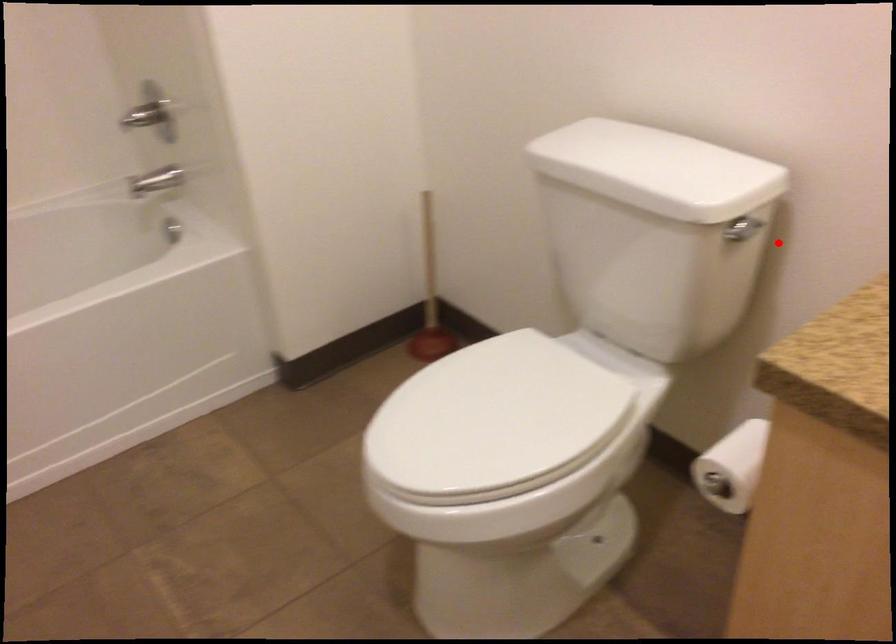
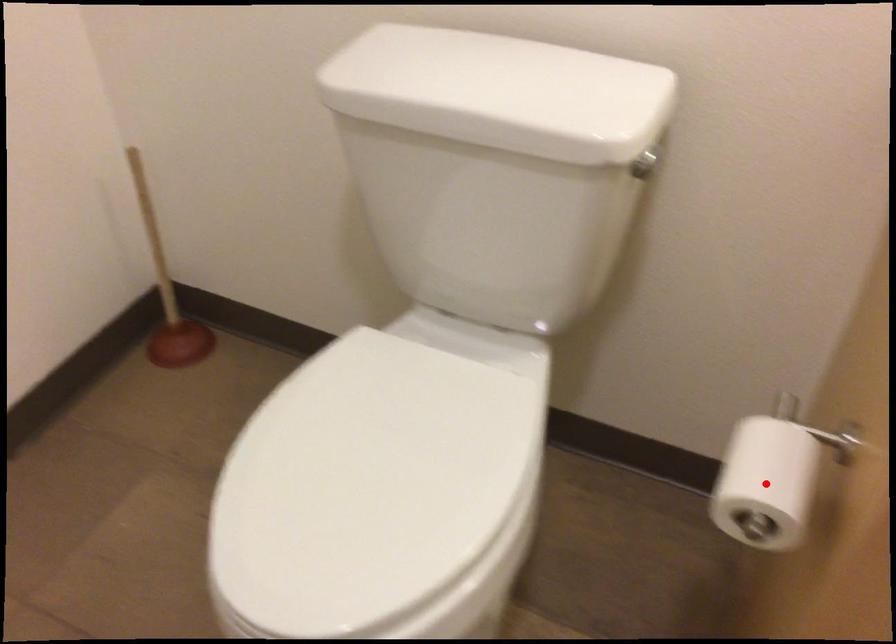
In the scene shown: I am providing you with two images of the same scene from different viewpoints. A red point is marked on the first image and another point is marked on the second image. Is the red point in image1 aligned with the point shown in image2?

No